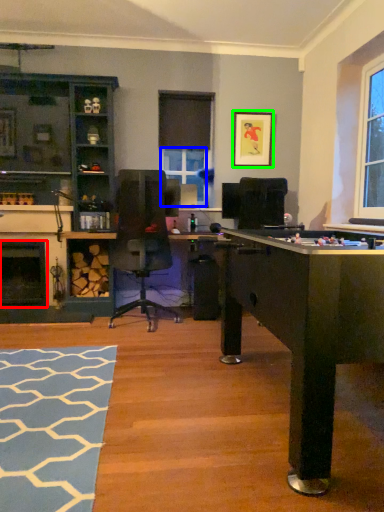
Question: Which is nearer to the fireplace (highlighted by a red box)? window screen (highlighted by a blue box) or picture frame (highlighted by a green box).

Choices:
 (A) window screen
 (B) picture frame

Answer: (A)